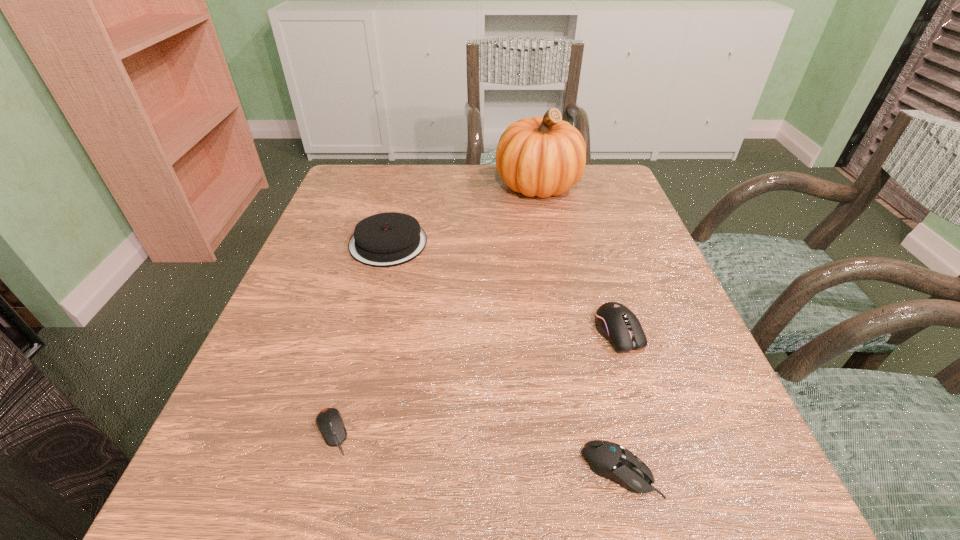
Locate an element on the screen. The height and width of the screenshot is (540, 960). empty space between the shortest object and the fourth nearest object is located at coordinates (360, 338).

The width and height of the screenshot is (960, 540). I want to click on free space between the farthest computer mouse and the pumpkin, so click(578, 258).

This screenshot has height=540, width=960. I want to click on blank region between the pancake and the second shortest computer mouse, so click(x=504, y=357).

Where is `free area in between the second shortest object and the shortest computer mouse`? This screenshot has height=540, width=960. free area in between the second shortest object and the shortest computer mouse is located at coordinates (476, 451).

This screenshot has height=540, width=960. Identify the location of free space between the farthest computer mouse and the shortest object. (475, 382).

What are the coordinates of `empty space between the leftmost computer mouse and the tallest object` in the screenshot? It's located at (435, 308).

Image resolution: width=960 pixels, height=540 pixels. What are the coordinates of `free space between the second shortest object and the third farthest object` in the screenshot? It's located at (619, 402).

You are a GUI agent. You are given a task and a screenshot of the screen. Output one action in this format:
    pyautogui.click(x=<x>, y=<y>)
    Task: Click on the object that can be found as the closest to the fourth tallest object
    This screenshot has height=540, width=960.
    Given the screenshot: What is the action you would take?
    pyautogui.click(x=617, y=323)

Locate which object is the second closest to the pancake. Please provide its 2D coordinates. Your answer should be formatted as a tuple, i.e. [(x, y)], where the tuple contains the x and y coordinates of a point satisfying the conditions above.

[(329, 421)]

Where is `computer mouse that is the second closest to the second farthest object`? Image resolution: width=960 pixels, height=540 pixels. computer mouse that is the second closest to the second farthest object is located at coordinates (617, 323).